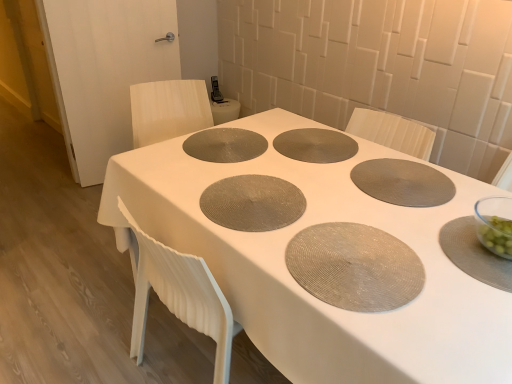
You are a GUI agent. You are given a task and a screenshot of the screen. Output one action in this format:
    pyautogui.click(x=<x>, y=<y>)
    Task: Click on the vacant space that is in between matte gray placemat at center, acting as the first pizza pan starting from the left, and matte gray placemat at center, acting as the first oval starting from the left
    This screenshot has width=512, height=384.
    Given the screenshot: What is the action you would take?
    pyautogui.click(x=232, y=164)